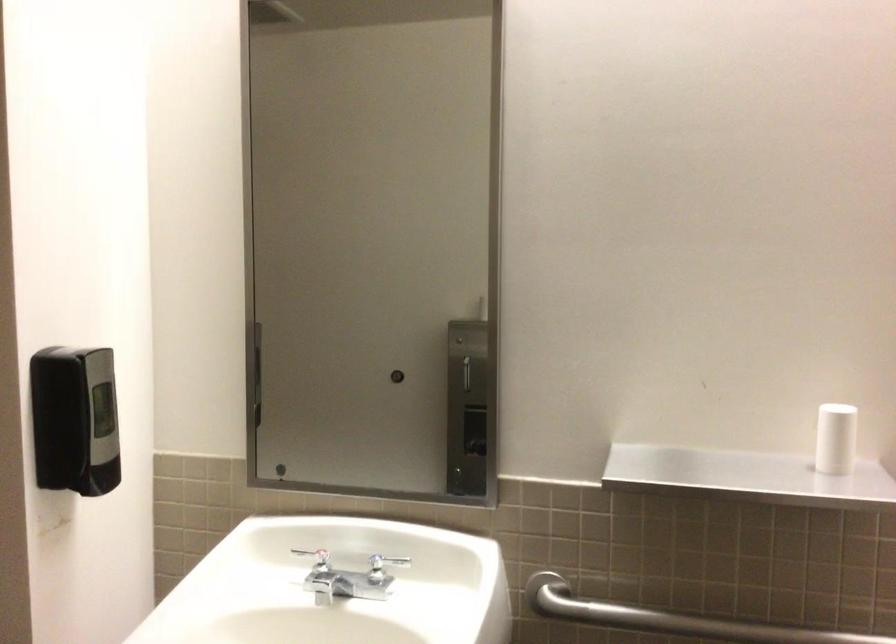
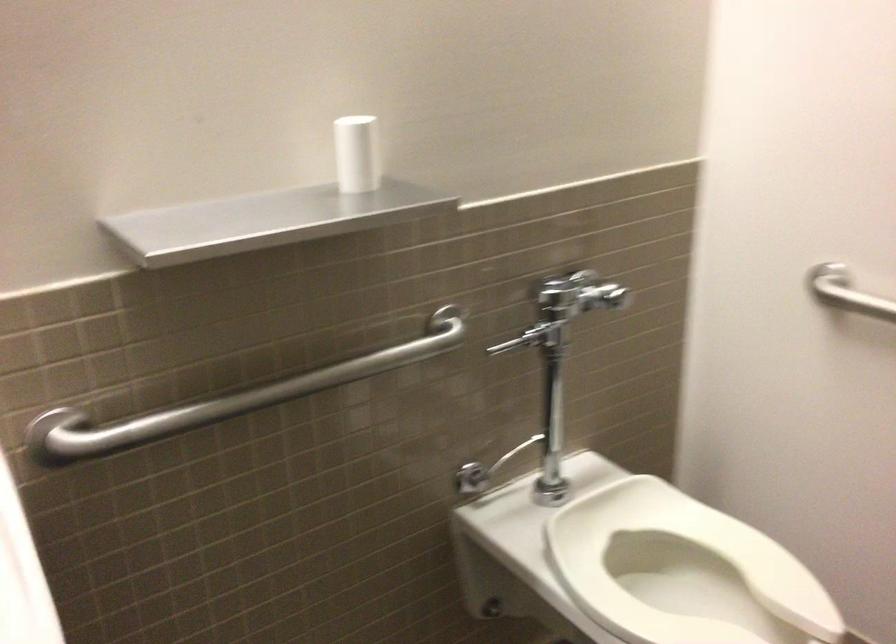
First-person continuous shooting, in which direction is the camera rotating?

The camera rotated toward right-down.